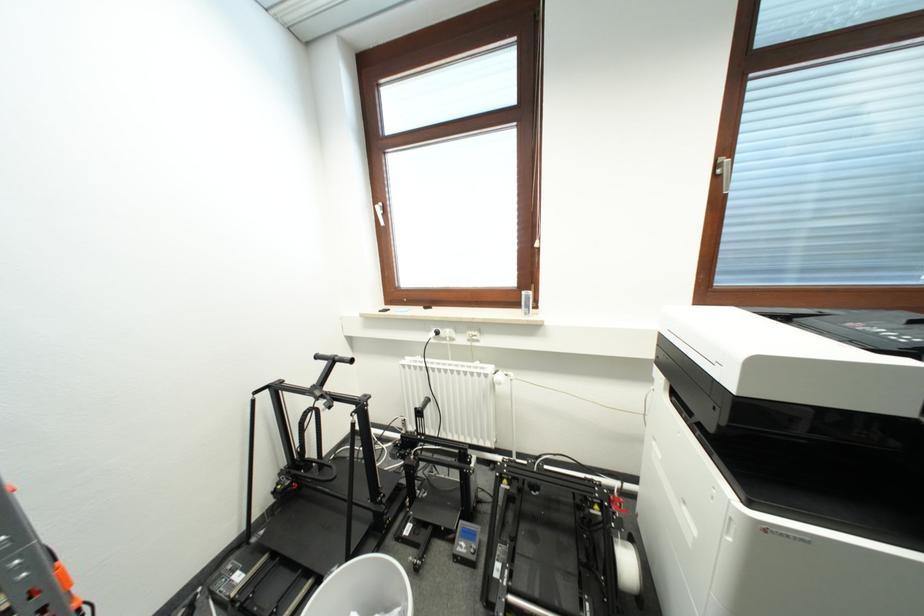
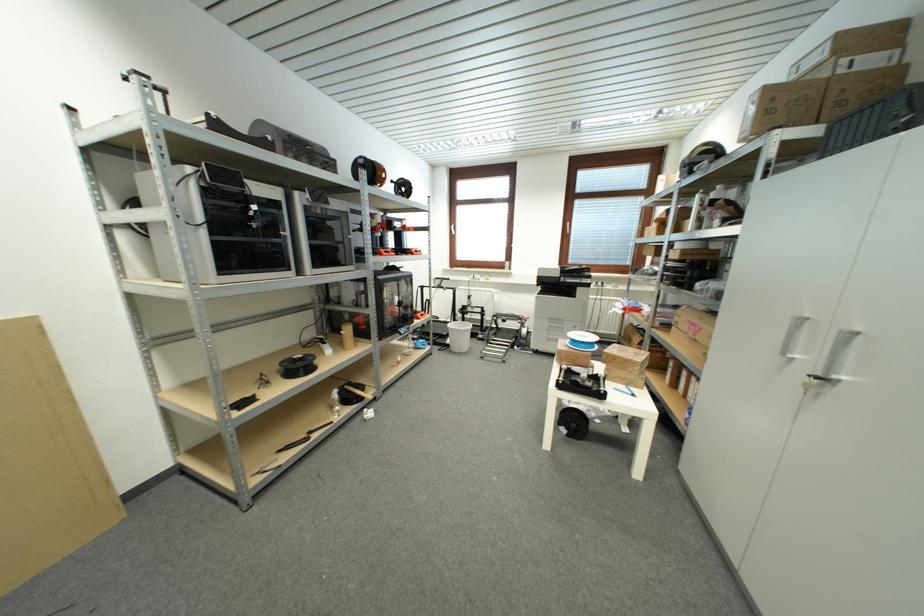
Question: What movement of the cameraman would produce the second image?

Choices:
 (A) Left
 (B) Right
 (C) Forward
 (D) Backward

Answer: (D)